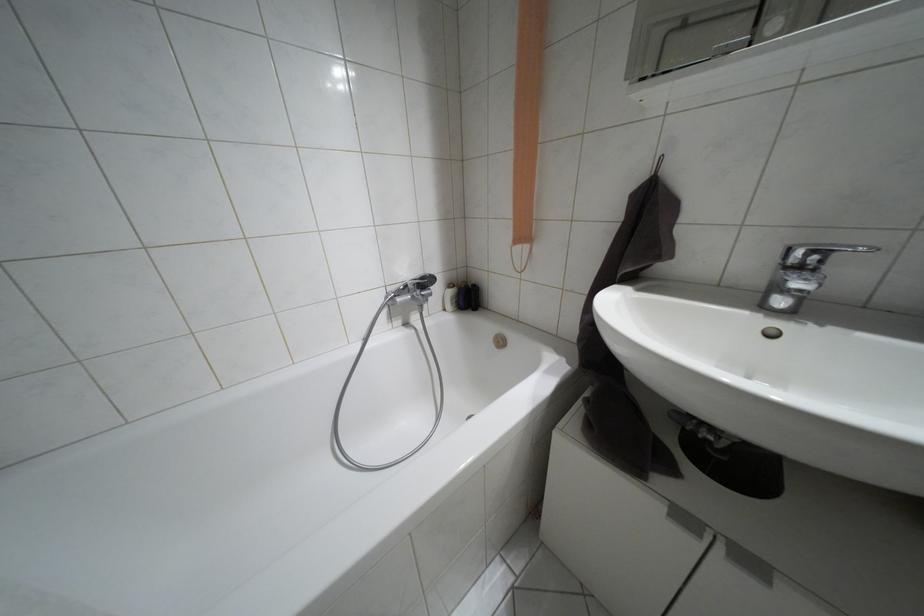
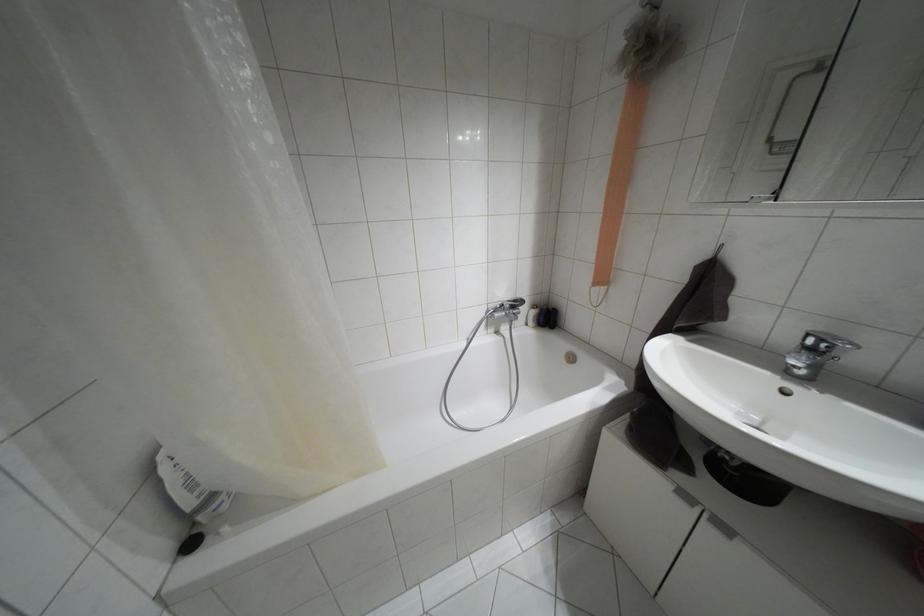
The point at (684, 517) is marked in the first image. Where is the corresponding point in the second image?

(685, 496)